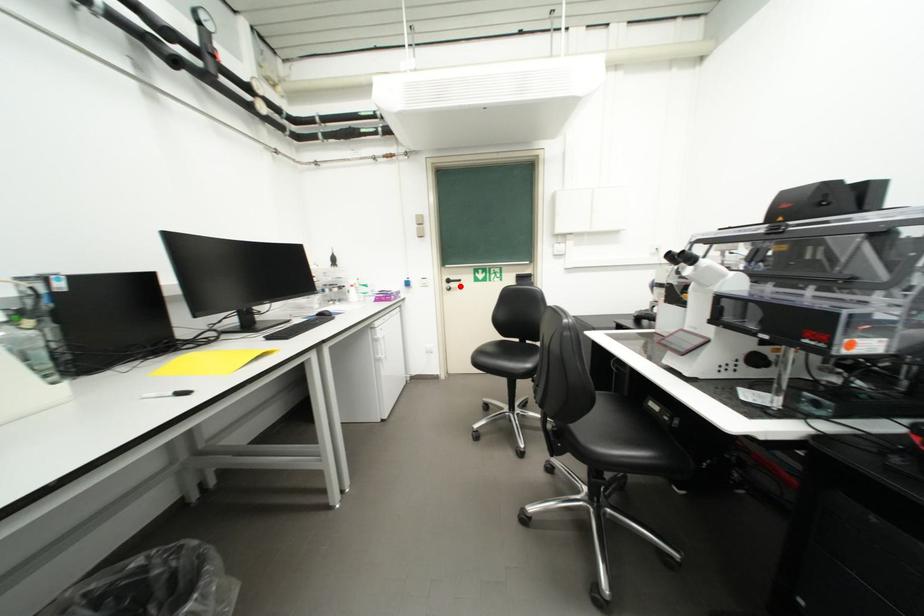
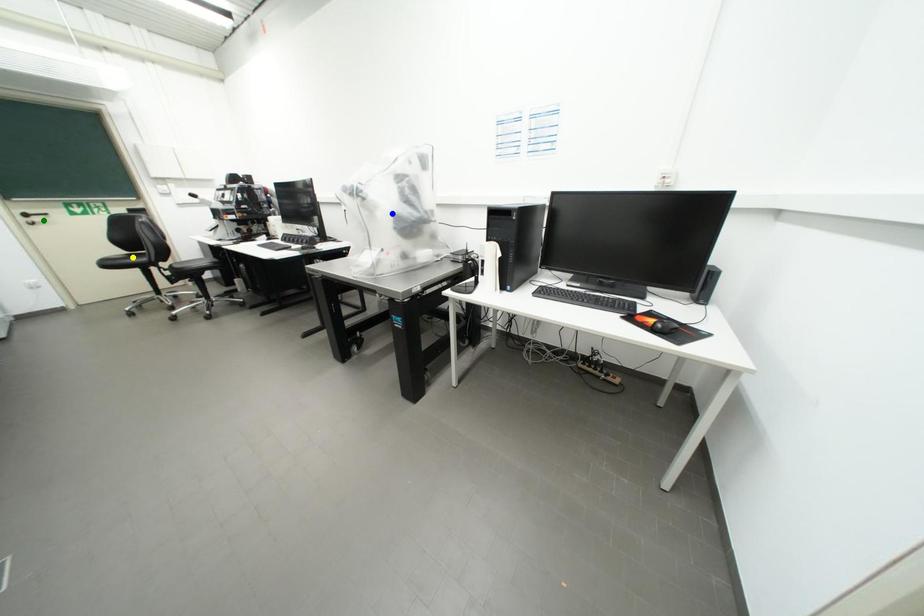
Question: I am providing you with two images of the same scene from different viewpoints. A red point is marked on the first image. You are given multiple points on the second image. In image 2, which mark is for the same physical point as the one in image 1?

Choices:
 (A) green point
 (B) yellow point
 (C) blue point

Answer: (A)